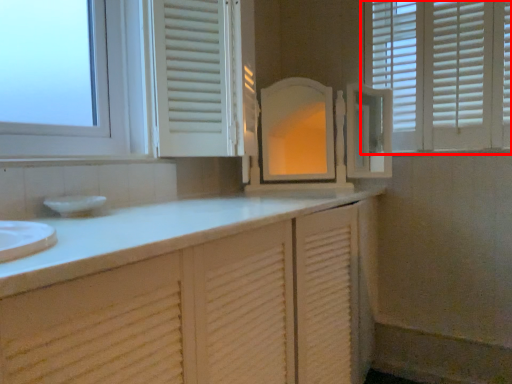
Question: From the image's perspective, where is window (annotated by the red box) located relative to window sill?

Choices:
 (A) below
 (B) above

Answer: (B)